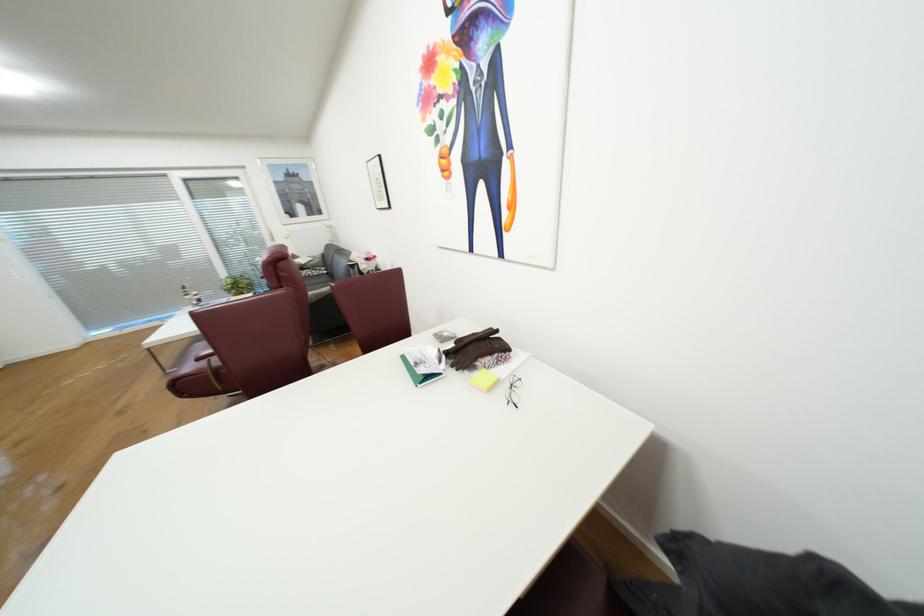
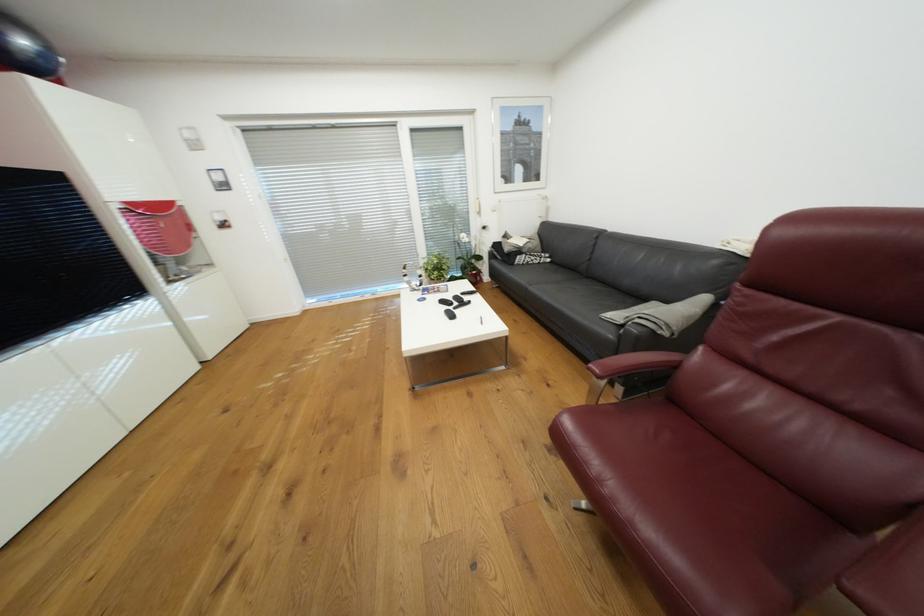
Locate, in the second image, the point that corresponds to (x=309, y=267) in the first image.

(526, 252)